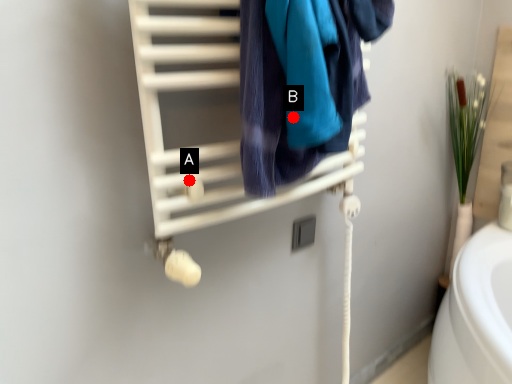
Question: Two points are circled on the image, labeled by A and B beside each circle. Among these points, which one is farthest from the camera?

Choices:
 (A) A is further
 (B) B is further

Answer: (A)